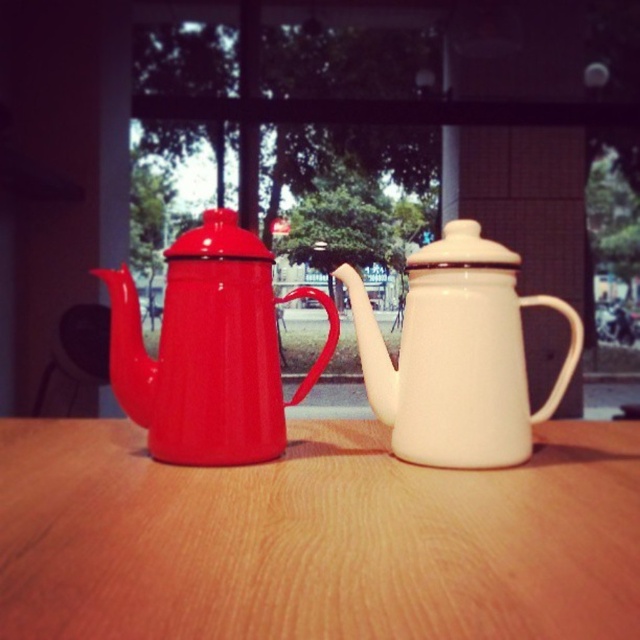
Which is behind, point (572, 468) or point (436, 456)?

Point (572, 468)

Which is behind, point (563, 632) or point (508, 419)?

Point (508, 419)

Find the location of a particular element. The height and width of the screenshot is (640, 640). wooden table at center is located at coordinates (316, 538).

Who is lower down, matte enamel teapot at center or matte enamel teapot at left?

matte enamel teapot at left is below.

The width and height of the screenshot is (640, 640). Describe the element at coordinates (209, 349) in the screenshot. I see `matte enamel teapot at center` at that location.

Between point (461, 243) and point (172, 333), which one is positioned behind?

Point (461, 243)

Where is `matte enamel teapot at center`? matte enamel teapot at center is located at coordinates (209, 349).

What do you see at coordinates (209, 349) in the screenshot?
I see `matte enamel teapot at left` at bounding box center [209, 349].

You are a GUI agent. You are given a task and a screenshot of the screen. Output one action in this format:
    pyautogui.click(x=<x>, y=<y>)
    Task: Click on the matte enamel teapot at left
    The width and height of the screenshot is (640, 640).
    Given the screenshot: What is the action you would take?
    pyautogui.click(x=209, y=349)